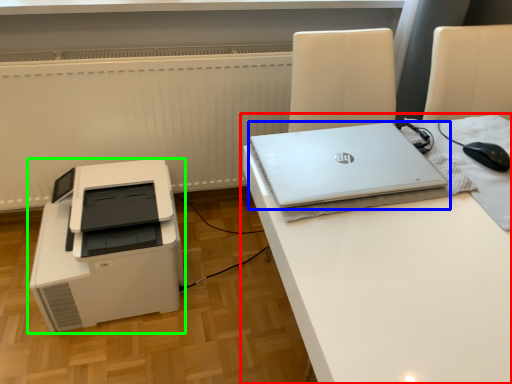
Question: Which object is the closest to the desk (highlighted by a red box)? Choose among these: laptop (highlighted by a blue box) or printer (highlighted by a green box).

Choices:
 (A) laptop
 (B) printer

Answer: (A)